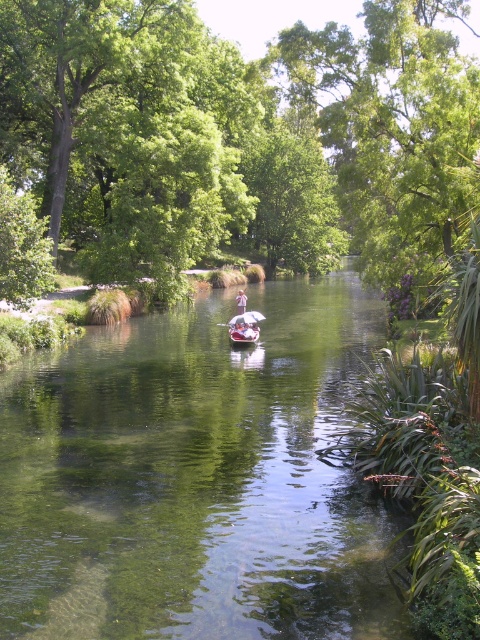
Question: Does metallic silver kayak at center have a lesser width compared to pink fabric person at center?

Choices:
 (A) no
 (B) yes

Answer: (B)

Question: Which of the following is the farthest from the observer?

Choices:
 (A) pink fabric person at center
 (B) clear water at center
 (C) green leafy tree at center

Answer: (A)

Question: Can you confirm if clear water at center is smaller than metallic silver kayak at center?

Choices:
 (A) yes
 (B) no

Answer: (B)

Question: Which point is farther to the camera?

Choices:
 (A) green leafy tree at center
 (B) pink fabric person at center
 (C) clear water at center
 (D) metallic silver kayak at center

Answer: (B)

Question: Among these objects, which one is farthest from the camera?

Choices:
 (A) metallic silver kayak at center
 (B) green leafy tree at center
 (C) clear water at center

Answer: (A)

Question: Can you confirm if green leafy tree at center is positioned to the left of metallic silver kayak at center?

Choices:
 (A) no
 (B) yes

Answer: (A)